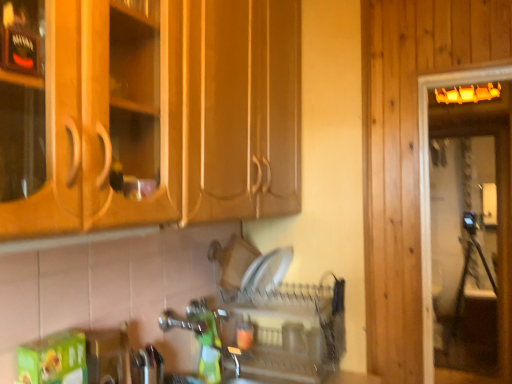
What do you see at coordinates (471, 242) in the screenshot? Image resolution: width=512 pixels, height=384 pixels. I see `transparent glass screen door at right` at bounding box center [471, 242].

You are a GUI agent. You are given a task and a screenshot of the screen. Output one action in this format:
    pyautogui.click(x=<x>, y=<y>)
    Task: Click on the transparent glass screen door at right
    
    Given the screenshot: What is the action you would take?
    pyautogui.click(x=471, y=242)

What is the approximate width of clear plastic dish rack at center?

clear plastic dish rack at center is 27.91 centimeters in width.

In order to click on clear plastic dish rack at center in this screenshot , I will do [296, 332].

In order to face clear plastic dish rack at center, should I rotate leftwards or rightwards?

You should look right and rotate roughly 3.510 degrees.

This screenshot has height=384, width=512. Describe the element at coordinates (296, 332) in the screenshot. I see `clear plastic dish rack at center` at that location.

The image size is (512, 384). I want to click on transparent glass screen door at right, so click(471, 242).

Between clear plastic dish rack at center and transparent glass screen door at right, which one appears on the left side from the viewer's perspective?

From the viewer's perspective, clear plastic dish rack at center appears more on the left side.

In the image, is clear plastic dish rack at center positioned in front of or behind transparent glass screen door at right?

Clearly, clear plastic dish rack at center is in front of transparent glass screen door at right.

Which is in front, point (313, 350) or point (470, 253)?

Positioned in front is point (313, 350).

From the image's perspective, is clear plastic dish rack at center positioned above or below transparent glass screen door at right?

From the image's perspective, clear plastic dish rack at center appears below transparent glass screen door at right.

From a real-world perspective, does clear plastic dish rack at center sit lower than transparent glass screen door at right?

Yes, from a real-world perspective, clear plastic dish rack at center is below transparent glass screen door at right.

Which object is thinner, clear plastic dish rack at center or transparent glass screen door at right?

transparent glass screen door at right.

Can you confirm if clear plastic dish rack at center is taller than transparent glass screen door at right?

No, clear plastic dish rack at center is not taller than transparent glass screen door at right.

Looking at the image, does clear plastic dish rack at center seem bigger or smaller compared to transparent glass screen door at right?

In the image, clear plastic dish rack at center appears to be smaller than transparent glass screen door at right.

Do you think clear plastic dish rack at center is within transparent glass screen door at right, or outside of it?

clear plastic dish rack at center lies outside transparent glass screen door at right.

Is clear plastic dish rack at center not near transparent glass screen door at right?

clear plastic dish rack at center is positioned a significant distance from transparent glass screen door at right.

Is clear plastic dish rack at center looking in the opposite direction of transparent glass screen door at right?

Correct, clear plastic dish rack at center is looking away from transparent glass screen door at right.

How many degrees apart are the facing directions of clear plastic dish rack at center and transparent glass screen door at right?

They differ by 3.76 degrees in their facing directions.

Locate an element on the screen. The image size is (512, 384). screen door above the clear plastic dish rack at center (from a real-world perspective) is located at coordinates (471, 242).

Based on their positions, is transparent glass screen door at right located to the left or right of clear plastic dish rack at center?

transparent glass screen door at right is positioned on clear plastic dish rack at center's right side.

Relative to clear plastic dish rack at center, is transparent glass screen door at right in front or behind?

In the image, transparent glass screen door at right appears behind clear plastic dish rack at center.

Does point (460, 278) come in front of point (322, 322)?

That is False.

From the image's perspective, would you say transparent glass screen door at right is positioned over clear plastic dish rack at center?

Indeed, from the image's perspective, transparent glass screen door at right is shown above clear plastic dish rack at center.

From a real-world perspective, does transparent glass screen door at right stand above clear plastic dish rack at center?

Yes, from a real-world perspective, transparent glass screen door at right is on top of clear plastic dish rack at center.

Which object is wider, transparent glass screen door at right or clear plastic dish rack at center?

A: Wider between the two is clear plastic dish rack at center.

Considering the sizes of objects transparent glass screen door at right and clear plastic dish rack at center in the image provided, who is taller, transparent glass screen door at right or clear plastic dish rack at center?

transparent glass screen door at right.

Which of these two, transparent glass screen door at right or clear plastic dish rack at center, is smaller?

clear plastic dish rack at center.

In the scene shown: Is transparent glass screen door at right situated inside clear plastic dish rack at center or outside?

transparent glass screen door at right lies outside clear plastic dish rack at center.

Are transparent glass screen door at right and clear plastic dish rack at center beside each other?

No.

Is transparent glass screen door at right facing towards clear plastic dish rack at center?

No, transparent glass screen door at right is not oriented towards clear plastic dish rack at center.

How different are the orientations of transparent glass screen door at right and clear plastic dish rack at center in degrees?

transparent glass screen door at right and clear plastic dish rack at center are facing 3.76 degrees away from each other.

The image size is (512, 384). Find the location of `dish washer on the left of transparent glass screen door at right`. dish washer on the left of transparent glass screen door at right is located at coordinates (296, 332).

Where is `screen door above the clear plastic dish rack at center (from the image's perspective)`? screen door above the clear plastic dish rack at center (from the image's perspective) is located at coordinates (471, 242).

Identify the location of dish washer that is in front of the transparent glass screen door at right. (296, 332).